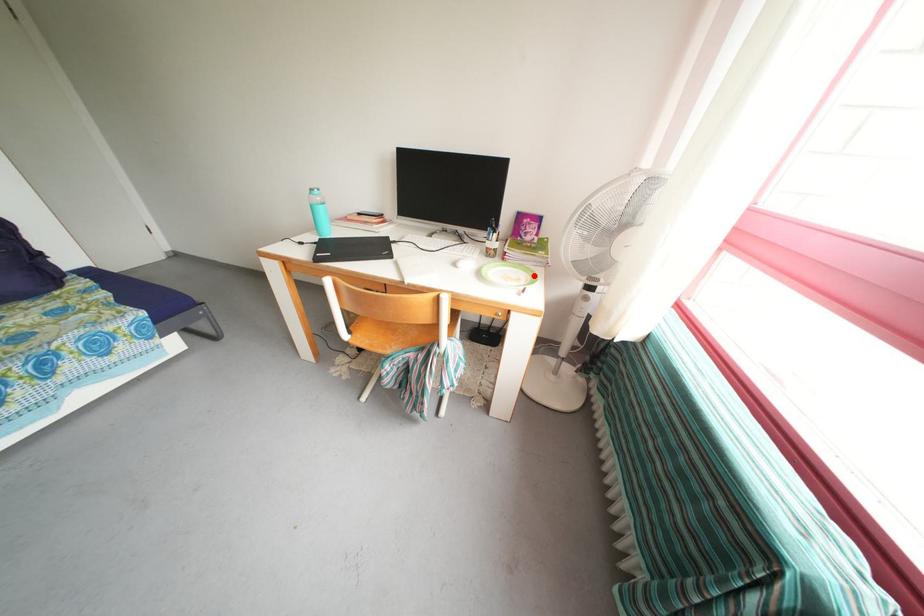
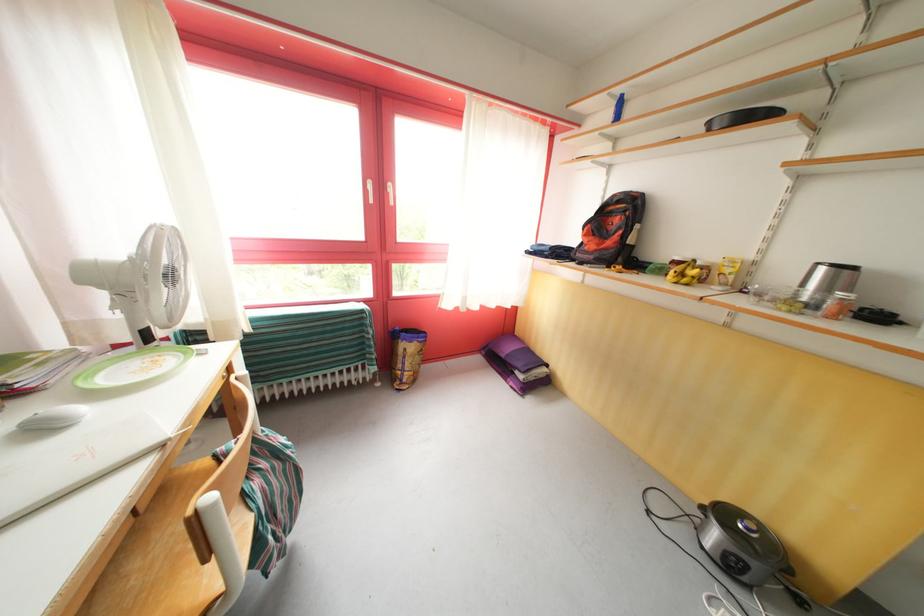
Find the pixel in the second image that matches the highlighted location in the first image.

(128, 363)